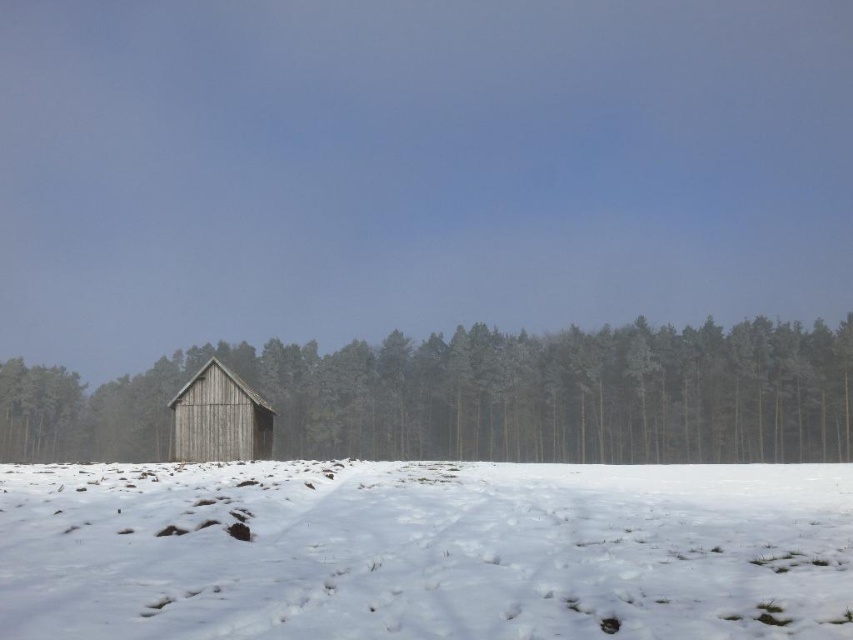
Between weathered wood shed at center and weathered wood barn at center, which one appears on the left side from the viewer's perspective?

Positioned to the left is weathered wood shed at center.

At what (x,y) coordinates should I click in order to perform the action: click on weathered wood shed at center. Please return your answer as a coordinate pair (x, y). Looking at the image, I should click on (480, 397).

Does white fluffy snow at center have a greater width compared to weathered wood barn at center?

Correct, the width of white fluffy snow at center exceeds that of weathered wood barn at center.

Can you confirm if white fluffy snow at center is positioned below weathered wood barn at center?

Actually, white fluffy snow at center is above weathered wood barn at center.

At what (x,y) coordinates should I click in order to perform the action: click on white fluffy snow at center. Please return your answer as a coordinate pair (x, y). Looking at the image, I should click on (425, 550).

Does point (589, 541) lie in front of point (627, 460)?

Yes.

This screenshot has height=640, width=853. I want to click on white fluffy snow at center, so click(425, 550).

Find the location of a particular element. white fluffy snow at center is located at coordinates (425, 550).

In order to click on white fluffy snow at center in this screenshot , I will do [x=425, y=550].